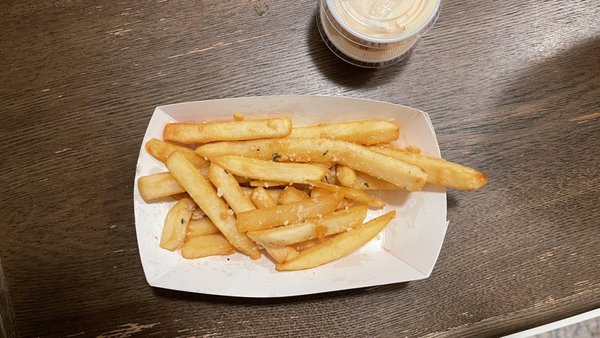
At what (x,y) coordinates should I click in order to perform the action: click on paper container. Please return your answer as a coordinate pair (x, y). Looking at the image, I should click on (373, 267).